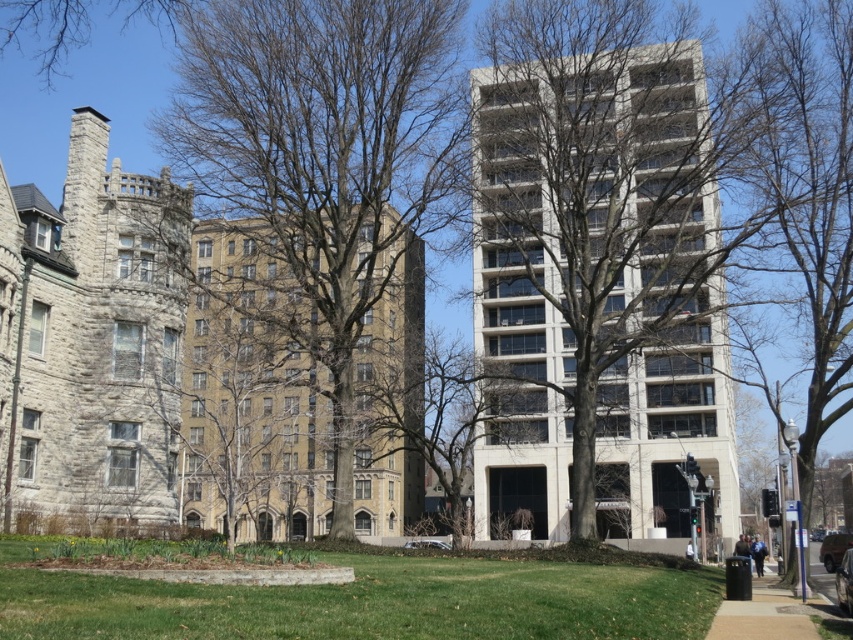
You are a drone operator who needs to fly a drone from the light gray concrete building at center to the bare branches at upper left. What is the approximate distance you need to cover?

The light gray concrete building at center is 56.81 meters from the bare branches at upper left, so the approximate distance you need to cover is 56.81 meters.

You are a photographer planning to take a picture of the light gray concrete building at center. However, there are bare branches at upper left in the way. From your current position, can you adjust your angle to capture the building without the branches blocking it?

The light gray concrete building at center is positioned under bare branches at upper left, so adjusting your angle downward might help avoid the branches blocking the building.

You are standing in the middle of the grassy area between the two buildings. You notice a smooth brown tree at center and bare branches at center. Which object is closer to the ground?

The smooth brown tree at center is closer to the ground because the bare branches at center is positioned over it.